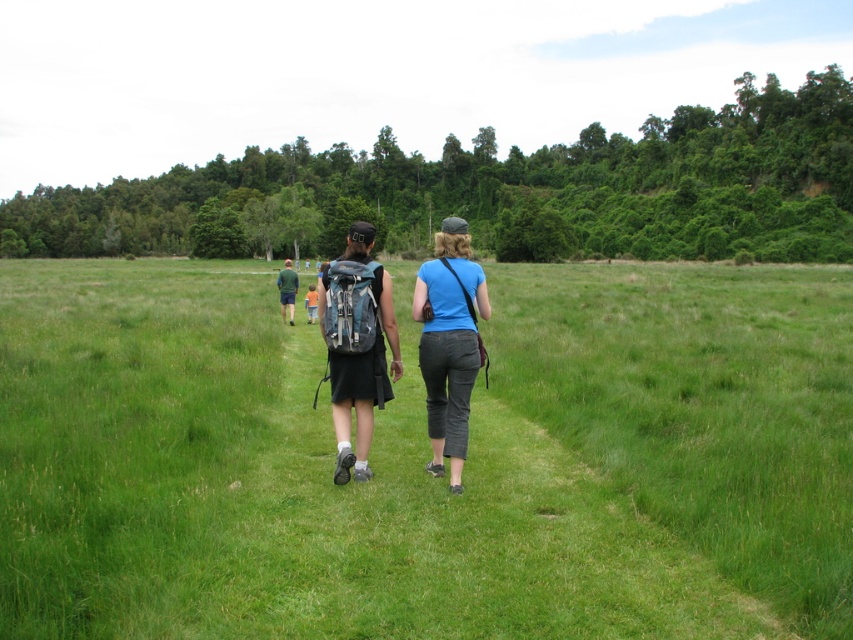
Is green grass at center thinner than matte gray backpack at center?

No, green grass at center is not thinner than matte gray backpack at center.

Is green grass at center positioned before matte gray backpack at center?

Yes, it is.

Describe the element at coordinates (426, 458) in the screenshot. I see `green grass at center` at that location.

This screenshot has width=853, height=640. I want to click on green grass at center, so [426, 458].

Is matte gray backpack at center closer to the viewer compared to green fabric shirt at center?

Yes, it is in front of green fabric shirt at center.

Is point (445, 294) positioned after point (292, 320)?

That is False.

Which is in front, point (370, 230) or point (292, 304)?

Positioned in front is point (370, 230).

Where is `matte gray backpack at center`? The width and height of the screenshot is (853, 640). matte gray backpack at center is located at coordinates (450, 392).

Can you confirm if matte gray backpack at center is smaller than blue cotton shirt at center?

Incorrect, matte gray backpack at center is not smaller in size than blue cotton shirt at center.

How distant is matte gray backpack at center from blue cotton shirt at center?

matte gray backpack at center and blue cotton shirt at center are 14.26 inches apart.

I want to click on matte gray backpack at center, so tap(450, 392).